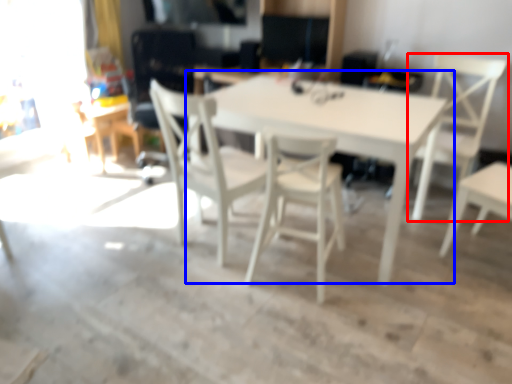
Question: Which point is closer to the camera, chair (highlighted by a red box) or table (highlighted by a blue box)?

Choices:
 (A) chair
 (B) table

Answer: (B)